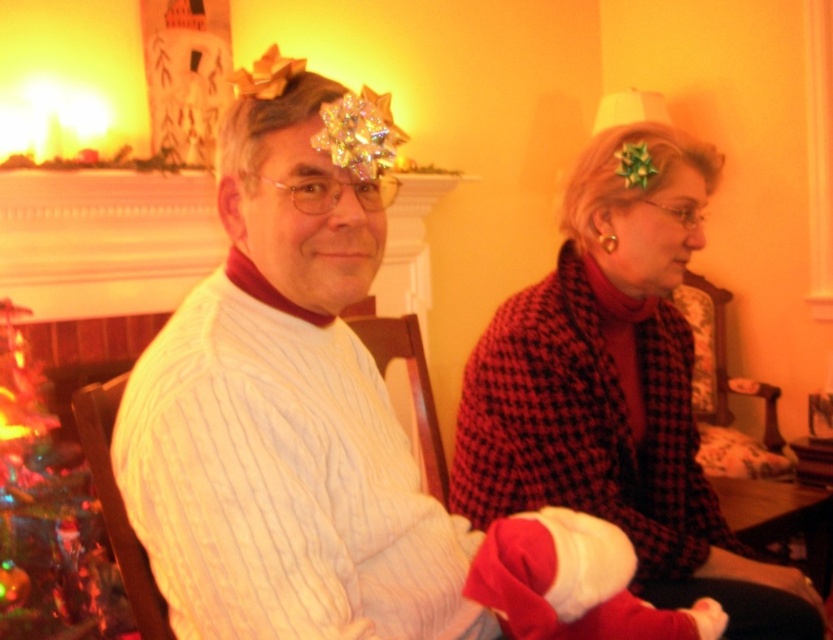
Question: Which of the following is the farthest from the observer?

Choices:
 (A) (597, 566)
 (B) (612, 314)

Answer: (B)

Question: Can you confirm if red houndstooth shawl at center is positioned above green artificial christmas tree at lower left?

Choices:
 (A) no
 (B) yes

Answer: (B)

Question: Can you confirm if red houndstooth shawl at center is positioned to the left of red velvet santa hat at lower center?

Choices:
 (A) yes
 (B) no

Answer: (B)

Question: Which of the following is the farthest from the observer?

Choices:
 (A) (13, 531)
 (B) (661, 625)
 (C) (546, 406)

Answer: (A)

Question: Where is red houndstooth shawl at center located in relation to red velvet santa hat at lower center in the image?

Choices:
 (A) above
 (B) below

Answer: (A)

Question: Which object appears farthest from the camera in this image?

Choices:
 (A) red houndstooth shawl at center
 (B) green artificial christmas tree at lower left

Answer: (B)